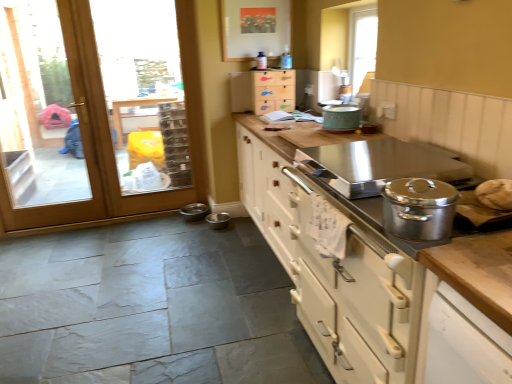
Question: Can you confirm if teal matte pot at upper center is positioned to the right of wooden at left?

Choices:
 (A) yes
 (B) no

Answer: (A)

Question: Can you confirm if teal matte pot at upper center is positioned to the left of wooden at left?

Choices:
 (A) no
 (B) yes

Answer: (A)

Question: From a real-world perspective, is teal matte pot at upper center physically below wooden at left?

Choices:
 (A) yes
 (B) no

Answer: (B)

Question: Is teal matte pot at upper center looking in the opposite direction of wooden at left?

Choices:
 (A) no
 (B) yes

Answer: (A)

Question: From the image's perspective, would you say teal matte pot at upper center is shown under wooden at left?

Choices:
 (A) yes
 (B) no

Answer: (A)

Question: Is wooden at left surrounded by teal matte pot at upper center?

Choices:
 (A) yes
 (B) no

Answer: (B)

Question: Considering the relative sizes of metallic stainless steel bowls at lower center, the second appliance in the right-to-left sequence, and wooden at left in the image provided, is metallic stainless steel bowls at lower center, the second appliance in the right-to-left sequence, wider than wooden at left?

Choices:
 (A) no
 (B) yes

Answer: (B)

Question: Does metallic stainless steel bowls at lower center, the 1th appliance in the left-to-right sequence, have a greater height compared to wooden at left?

Choices:
 (A) yes
 (B) no

Answer: (B)

Question: Is metallic stainless steel bowls at lower center, the 1th appliance in the left-to-right sequence, not close to wooden at left?

Choices:
 (A) yes
 (B) no

Answer: (A)

Question: Could you tell me if metallic stainless steel bowls at lower center, the second appliance in the right-to-left sequence, is facing wooden at left?

Choices:
 (A) yes
 (B) no

Answer: (B)

Question: From the image's perspective, would you say metallic stainless steel bowls at lower center, the 1th appliance in the left-to-right sequence, is shown under wooden at left?

Choices:
 (A) no
 (B) yes

Answer: (B)

Question: Considering the relative positions of metallic stainless steel bowls at lower center, the second appliance in the right-to-left sequence, and wooden at left in the image provided, is metallic stainless steel bowls at lower center, the second appliance in the right-to-left sequence, to the right of wooden at left from the viewer's perspective?

Choices:
 (A) yes
 (B) no

Answer: (A)

Question: Does metallic stainless steel bowl at lower center, arranged as the 2th appliance when viewed from the left, have a lesser width compared to metallic stainless steel bowls at lower center, the 1th appliance in the left-to-right sequence?

Choices:
 (A) no
 (B) yes

Answer: (B)